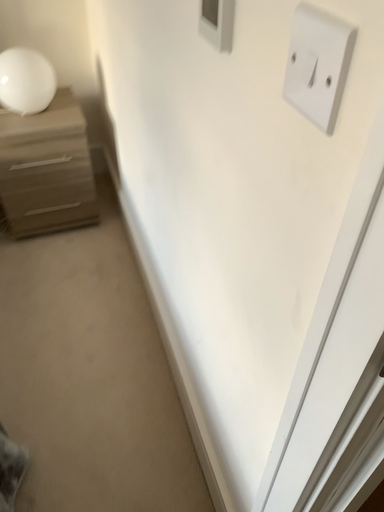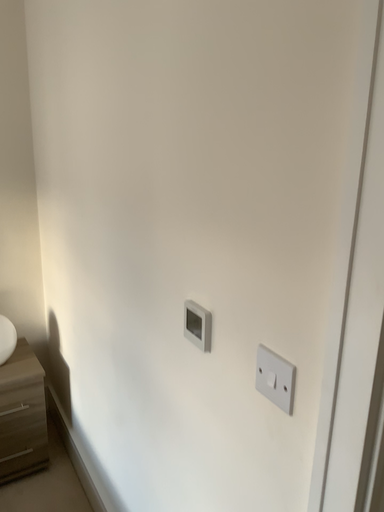
Question: Which way did the camera rotate in the video?

Choices:
 (A) rotated left
 (B) rotated right

Answer: (B)